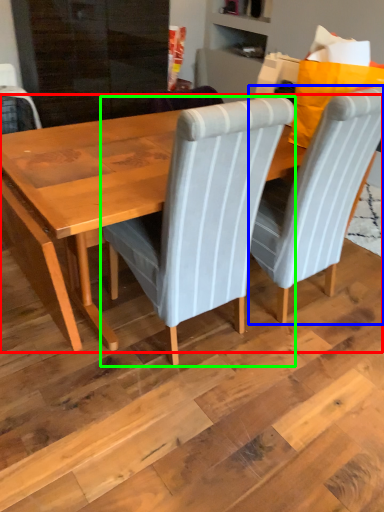
Question: Considering the real-world distances, which object is closest to table (highlighted by a red box)? chair (highlighted by a blue box) or chair (highlighted by a green box).

Choices:
 (A) chair
 (B) chair

Answer: (B)